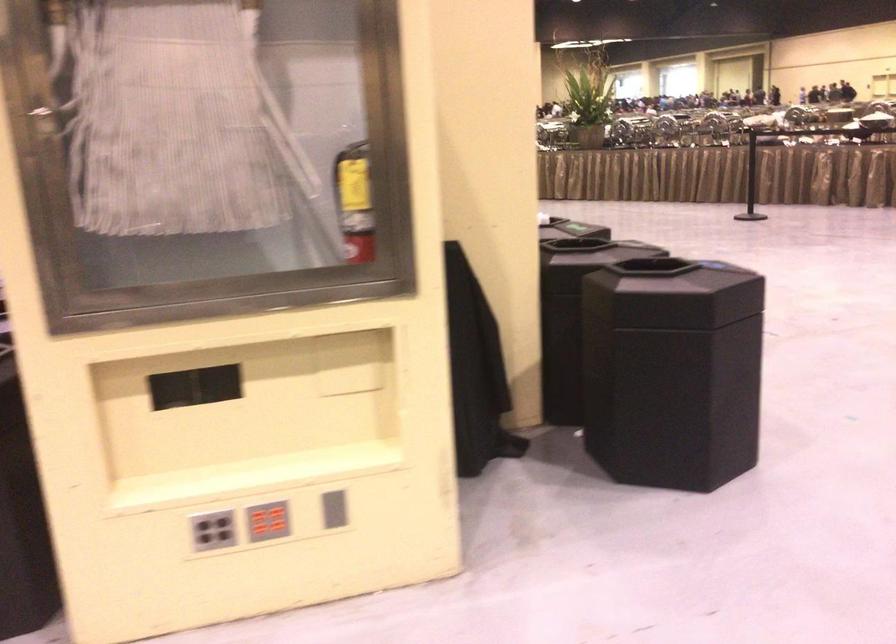
This screenshot has width=896, height=644. What do you see at coordinates (555, 174) in the screenshot? I see `a grey vertical slot` at bounding box center [555, 174].